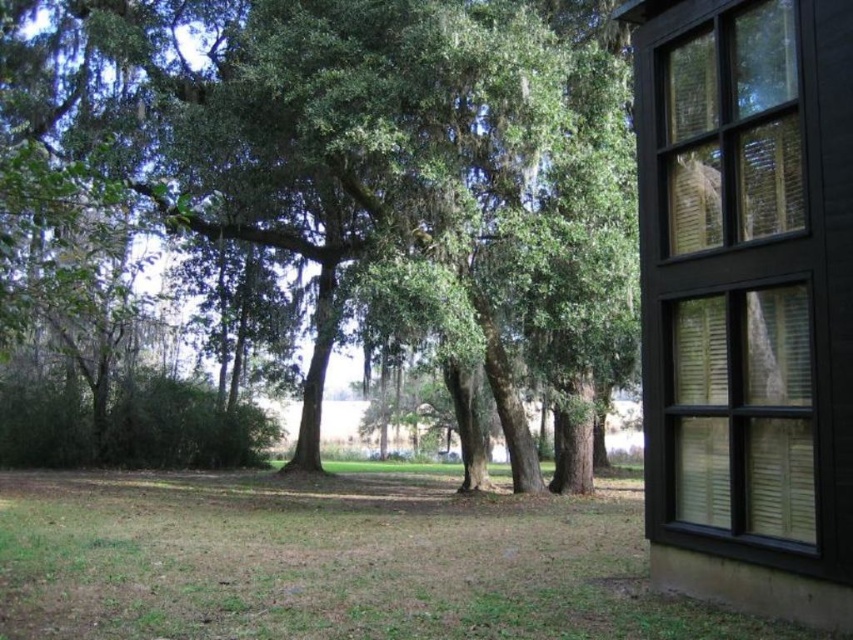
Question: In this image, where is black wooden window at right located relative to green grass at lower center?

Choices:
 (A) left
 (B) right

Answer: (B)

Question: Among these objects, which one is farthest from the camera?

Choices:
 (A) green leafy tree at center
 (B) black wooden window at right
 (C) green grass at lower center

Answer: (B)

Question: Which of the following is the farthest from the observer?

Choices:
 (A) black wooden window at right
 (B) green leafy tree at center
 (C) green grass at lower center

Answer: (A)

Question: Can you confirm if green leafy tree at center is positioned to the left of black wooden window at right?

Choices:
 (A) no
 (B) yes

Answer: (B)

Question: Among these points, which one is nearest to the camera?

Choices:
 (A) (770, 385)
 (B) (187, 572)

Answer: (A)

Question: Does green leafy tree at center come behind green grass at lower center?

Choices:
 (A) no
 (B) yes

Answer: (A)